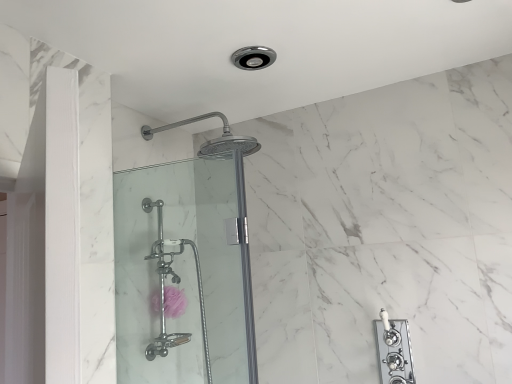
Question: Can we say clear glass shower door at center lies outside pink sponge at lower center?

Choices:
 (A) no
 (B) yes

Answer: (B)

Question: From the image's perspective, is clear glass shower door at center located beneath pink sponge at lower center?

Choices:
 (A) yes
 (B) no

Answer: (B)

Question: From the image's perspective, does clear glass shower door at center appear higher than pink sponge at lower center?

Choices:
 (A) yes
 (B) no

Answer: (A)

Question: Considering the relative sizes of clear glass shower door at center and pink sponge at lower center in the image provided, is clear glass shower door at center taller than pink sponge at lower center?

Choices:
 (A) no
 (B) yes

Answer: (B)

Question: Is the depth of clear glass shower door at center greater than that of pink sponge at lower center?

Choices:
 (A) no
 (B) yes

Answer: (A)

Question: Does clear glass shower door at center lie in front of pink sponge at lower center?

Choices:
 (A) no
 (B) yes

Answer: (B)

Question: Is pink sponge at lower center shorter than clear glass shower door at center?

Choices:
 (A) no
 (B) yes

Answer: (B)

Question: Would you say clear glass shower door at center is part of pink sponge at lower center's contents?

Choices:
 (A) no
 (B) yes

Answer: (A)

Question: Is pink sponge at lower center facing away from clear glass shower door at center?

Choices:
 (A) yes
 (B) no

Answer: (B)

Question: Is pink sponge at lower center to the right of clear glass shower door at center from the viewer's perspective?

Choices:
 (A) no
 (B) yes

Answer: (A)

Question: Is pink sponge at lower center closer to the viewer compared to clear glass shower door at center?

Choices:
 (A) yes
 (B) no

Answer: (B)

Question: Is pink sponge at lower center behind clear glass shower door at center?

Choices:
 (A) no
 (B) yes

Answer: (B)

Question: Do you think clear glass shower door at center is within pink sponge at lower center, or outside of it?

Choices:
 (A) outside
 (B) inside

Answer: (A)